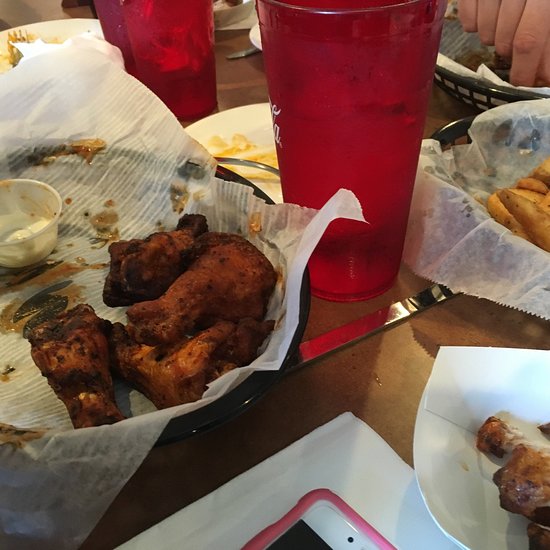
Where is `brown table`? The width and height of the screenshot is (550, 550). brown table is located at coordinates (425, 354).